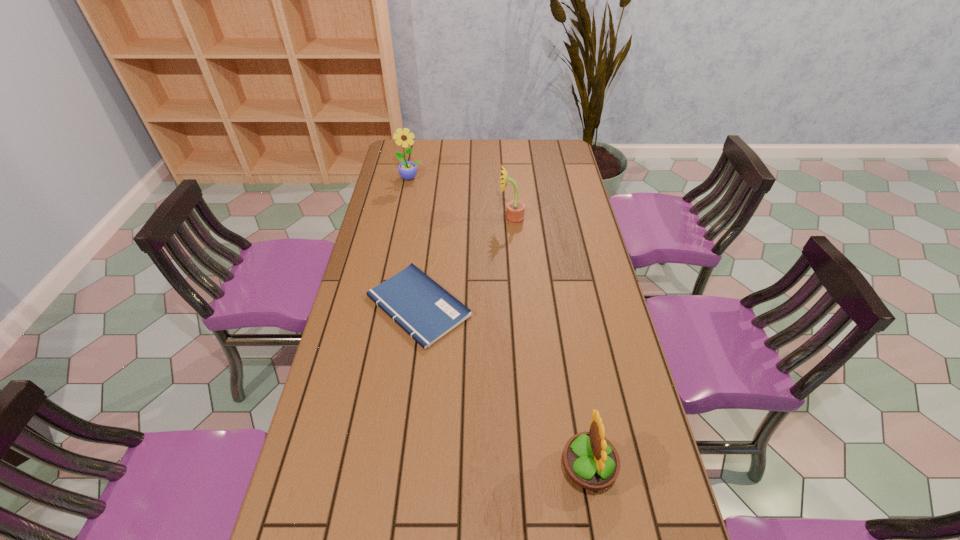
Locate an element on the screen. The height and width of the screenshot is (540, 960). the farthest sunflower is located at coordinates (407, 169).

In order to click on the leftmost sunflower in this screenshot , I will do `click(407, 169)`.

Where is `the second object from right to left`? the second object from right to left is located at coordinates (515, 210).

Identify the location of the second sunflower from right to left. (515, 210).

The height and width of the screenshot is (540, 960). What are the coordinates of `the shortest sunflower` in the screenshot? It's located at (592, 462).

Locate an element on the screen. The height and width of the screenshot is (540, 960). the third tallest object is located at coordinates (592, 462).

The height and width of the screenshot is (540, 960). Identify the location of paperback book. (426, 311).

Identify the location of the shortest object. This screenshot has width=960, height=540. (426, 311).

You are a GUI agent. You are given a task and a screenshot of the screen. Output one action in this format:
    pyautogui.click(x=<x>, y=<y>)
    Task: Click on the vacant space located on the front-facing side of the farthest object
    This screenshot has width=960, height=540.
    Given the screenshot: What is the action you would take?
    pyautogui.click(x=400, y=228)

This screenshot has width=960, height=540. I want to click on blank space located 0.130m on the face of the second sunflower from left to right, so click(465, 219).